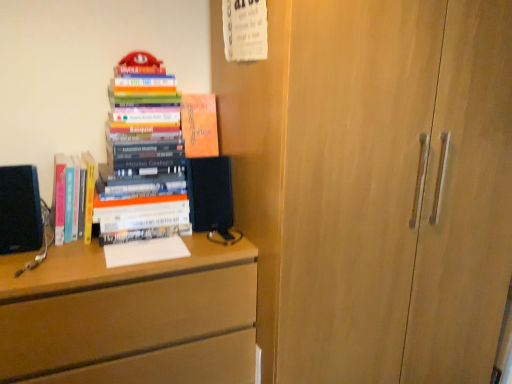
Image resolution: width=512 pixels, height=384 pixels. What are the coordinates of `vacant area that is in front of hardcover books at left, the third book from the right` in the screenshot? It's located at (54, 255).